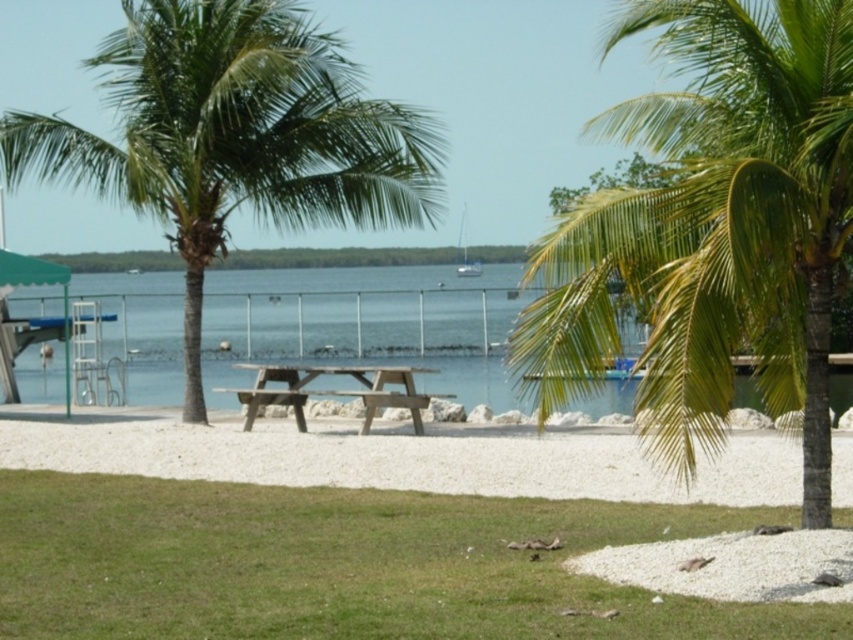
Question: Can you confirm if green leafy palm tree at center is bigger than clear blue water at center?

Choices:
 (A) yes
 (B) no

Answer: (A)

Question: Which point appears farthest from the camera in this image?

Choices:
 (A) (206, 109)
 (B) (844, 225)
 (C) (462, 257)

Answer: (C)

Question: Which object appears farthest from the camera in this image?

Choices:
 (A) clear blue water at center
 (B) green leafy palm tree at center

Answer: (A)

Question: Is green leafy palm tree at center further to the viewer compared to white plastic boat at center?

Choices:
 (A) yes
 (B) no

Answer: (B)

Question: Can you confirm if green leafy palm tree at upper right is positioned to the left of brown wooden picnic table at center?

Choices:
 (A) no
 (B) yes

Answer: (A)

Question: Which point is farther from the camera taking this photo?

Choices:
 (A) (688, 209)
 (B) (235, 97)

Answer: (B)